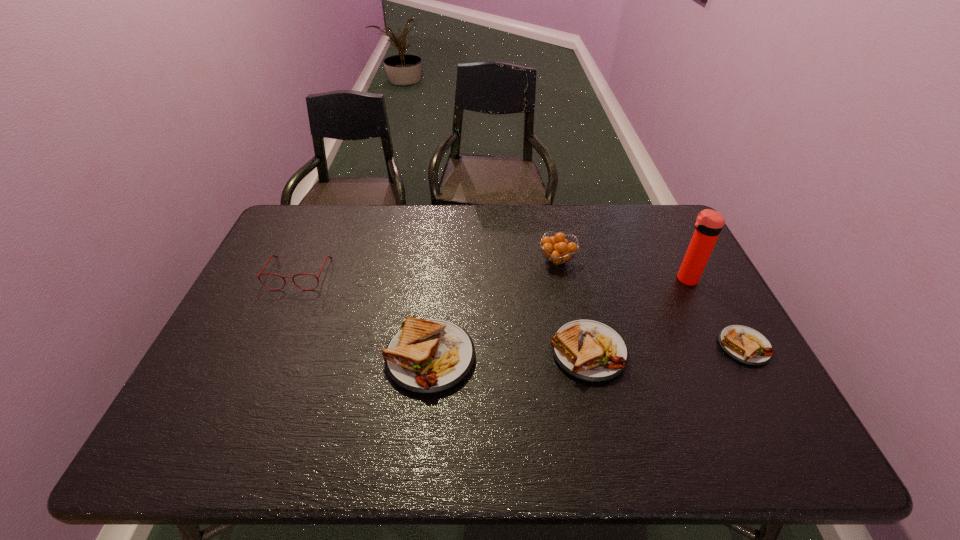
Image resolution: width=960 pixels, height=540 pixels. Identify the location of vacant space located on the back of the shortest object. (711, 286).

Where is `vacant space located 0.340m on the face of the spectacles`? Image resolution: width=960 pixels, height=540 pixels. vacant space located 0.340m on the face of the spectacles is located at coordinates (247, 392).

Locate an element on the screen. vacant space located on the front of the fifth shortest object is located at coordinates (570, 327).

Find the location of `free spot located on the left of the thermos bottle`. free spot located on the left of the thermos bottle is located at coordinates (594, 279).

Locate an element on the screen. object present at the left edge is located at coordinates (271, 256).

I want to click on sandwich situated at the right edge, so click(746, 345).

Find the location of `thermos bottle that is at the right edge`. thermos bottle that is at the right edge is located at coordinates (709, 223).

Identify the location of free space at the far edge of the desktop. (454, 245).

The image size is (960, 540). In the image, there is a desktop. Find the location of `vacant space at the near edge`. vacant space at the near edge is located at coordinates (679, 395).

This screenshot has width=960, height=540. I want to click on free spot at the left edge of the desktop, so click(x=273, y=318).